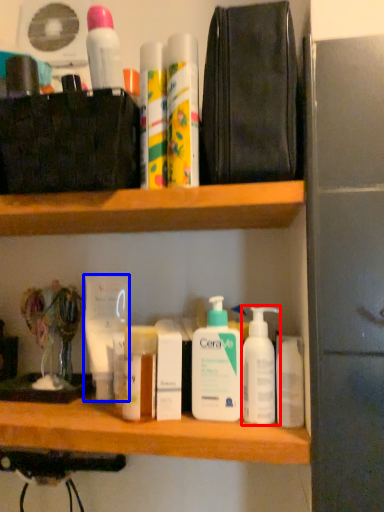
Question: Which object is further to the camera taking this photo, cleaning product (highlighted by a red box) or mouthwash (highlighted by a blue box)?

Choices:
 (A) cleaning product
 (B) mouthwash

Answer: (B)